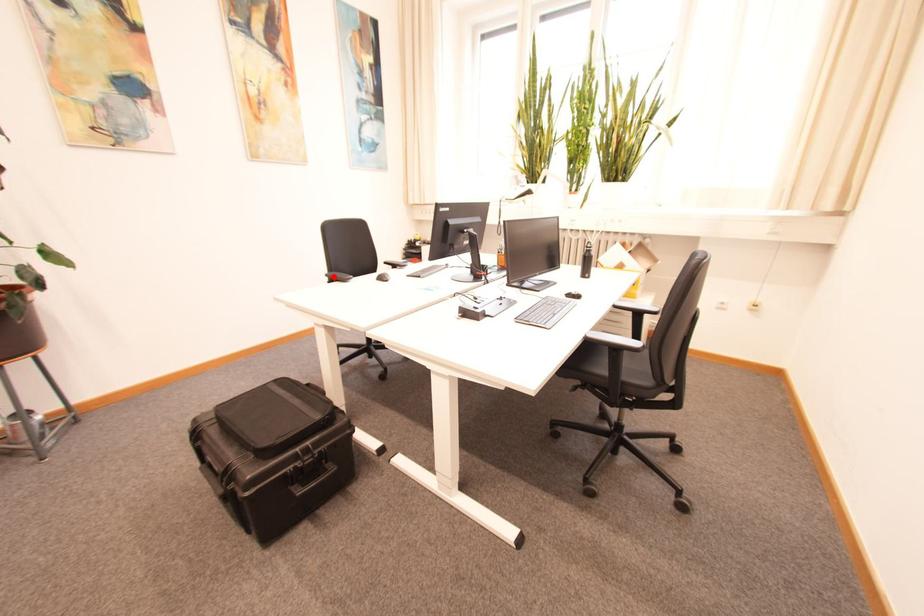
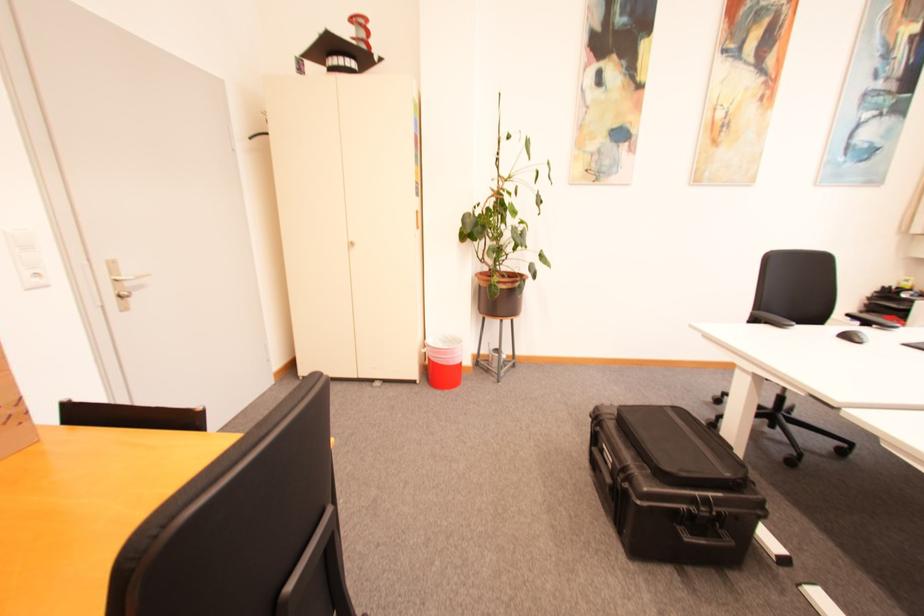
Find the pixel in the second image that matches the highlighted location in the first image.

(759, 315)